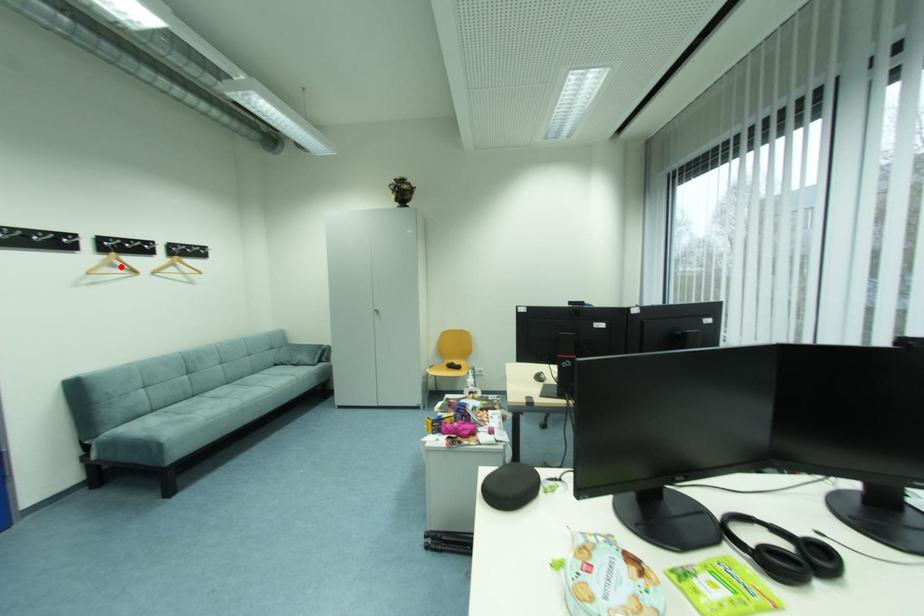
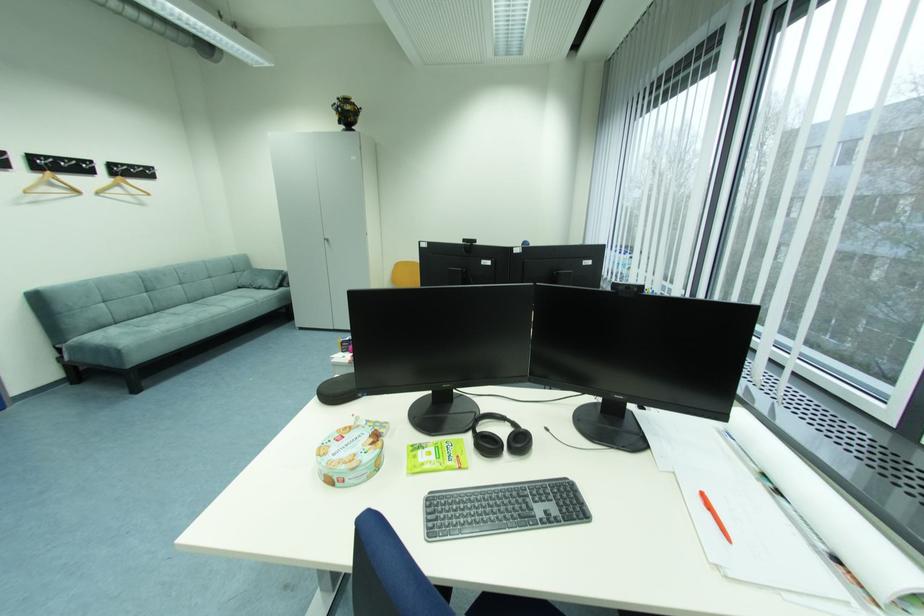
Question: I am providing you with two images of the same scene from different viewpoints. In image1, a red point is highlighted. Considering the same 3D point in image2, which of the following is correct?

Choices:
 (A) It is closer
 (B) It is farther

Answer: (B)